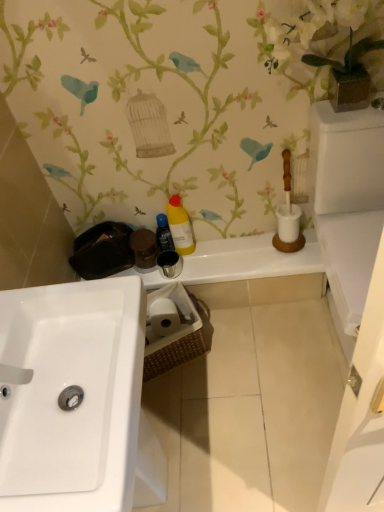
Question: Considering the positions of yellow matte bottle at center, the 1th cleaning product when ordered from right to left, and matte black toiletries at center in the image, is yellow matte bottle at center, the 1th cleaning product when ordered from right to left, wider or thinner than matte black toiletries at center?

Choices:
 (A) thin
 (B) wide

Answer: (A)

Question: Choose the correct answer: Is yellow matte bottle at center, the 1th cleaning product when ordered from right to left, inside matte black toiletries at center or outside it?

Choices:
 (A) inside
 (B) outside

Answer: (B)

Question: Which is farther from the white matte vase at upper right?

Choices:
 (A) yellow matte bottle at center, arranged as the 1th cleaning product when viewed from the left
 (B) yellow matte bottle at center, which is the 2th cleaning product in left-to-right order
 (C) matte black toiletries at center
 (D) white glossy sink at lower left

Answer: (D)

Question: Estimate the real-world distances between objects in this image. Which object is closer to the yellow matte bottle at center, the second cleaning product positioned from the right?

Choices:
 (A) yellow matte bottle at center, the 1th cleaning product when ordered from right to left
 (B) white glossy sink at lower left
 (C) white matte vase at upper right
 (D) matte black toiletries at center

Answer: (A)